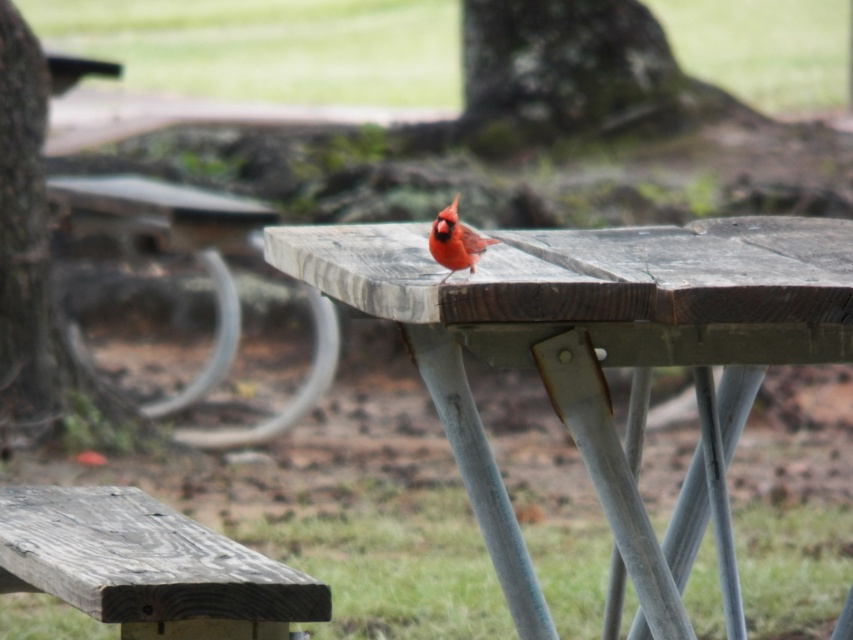
Question: Which point is closer to the camera taking this photo?

Choices:
 (A) (163, 518)
 (B) (503, 337)
 (C) (440, 230)
 (D) (4, 346)

Answer: (B)

Question: Is wooden picnic table at center positioned behind smooth bark tree at left?

Choices:
 (A) yes
 (B) no

Answer: (B)

Question: Which point is closer to the camera?

Choices:
 (A) smooth bark tree at left
 (B) matte red cardinal at center

Answer: (B)

Question: Does wooden picnic table at center have a greater width compared to matte red cardinal at center?

Choices:
 (A) yes
 (B) no

Answer: (A)

Question: Which point is closer to the camera?

Choices:
 (A) matte red cardinal at center
 (B) weathered wood bench at lower left
 (C) wooden picnic table at center

Answer: (C)

Question: Can you confirm if wooden picnic table at center is positioned to the left of matte red cardinal at center?

Choices:
 (A) yes
 (B) no

Answer: (B)